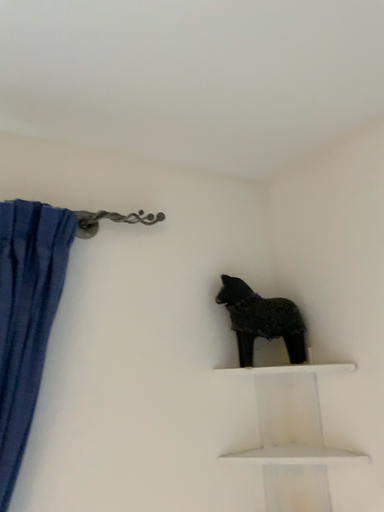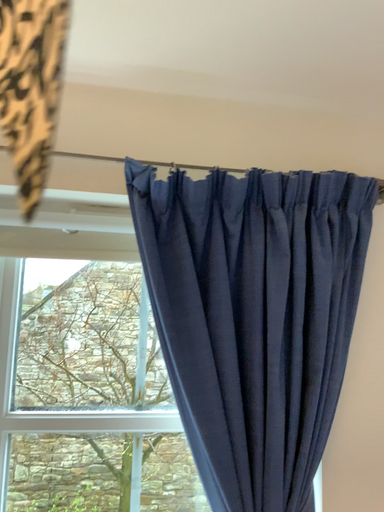
Question: How did the camera likely rotate when shooting the video?

Choices:
 (A) rotated left
 (B) rotated right

Answer: (A)